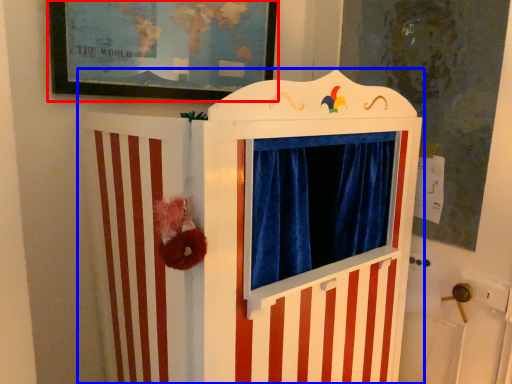
Question: Which object is closer to the camera taking this photo, picture frame (highlighted by a red box) or furniture (highlighted by a blue box)?

Choices:
 (A) picture frame
 (B) furniture

Answer: (B)